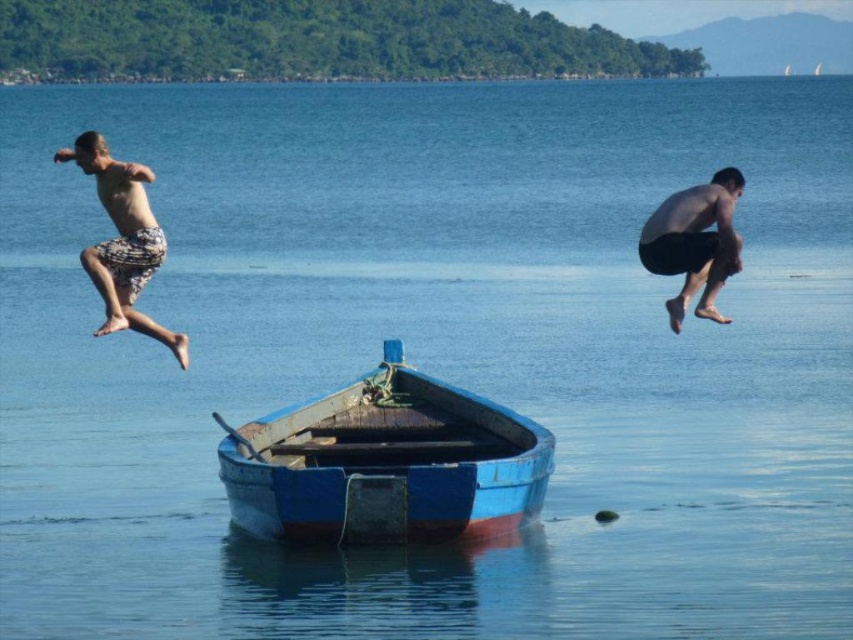
Question: Which object is positioned farthest from the printed shorts man at left?

Choices:
 (A) black matte shorts at right
 (B) blue wooden boat at center

Answer: (A)

Question: In this image, where is blue wooden boat at center located relative to printed shorts man at left?

Choices:
 (A) below
 (B) above

Answer: (A)

Question: Which point is farther to the camera?

Choices:
 (A) blue wooden boat at center
 (B) black matte shorts at right

Answer: (B)

Question: Which point is closer to the camera?

Choices:
 (A) blue wooden boat at center
 (B) black matte shorts at right
 (C) printed shorts man at left

Answer: (A)

Question: Is blue wooden boat at center further to camera compared to black matte shorts at right?

Choices:
 (A) yes
 (B) no

Answer: (B)

Question: Does printed shorts man at left lie behind black matte shorts at right?

Choices:
 (A) no
 (B) yes

Answer: (A)